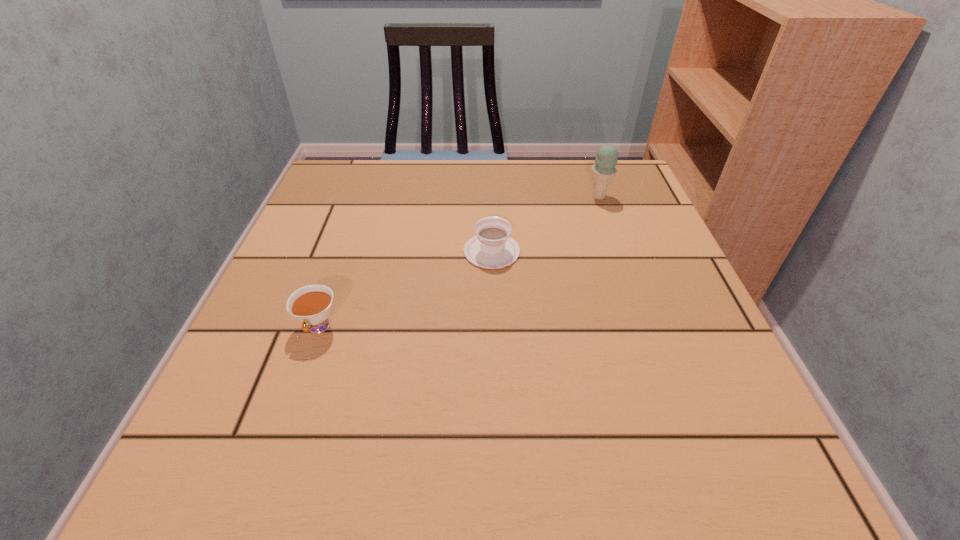
Find the location of a particular element. The width and height of the screenshot is (960, 540). empty space that is in between the second farthest object and the leftmost object is located at coordinates pyautogui.click(x=405, y=289).

Image resolution: width=960 pixels, height=540 pixels. I want to click on empty space between the tallest object and the leftmost object, so click(x=459, y=262).

Identify which object is the closest to the right teacup. Please provide its 2D coordinates. Your answer should be formatted as a tuple, i.e. [(x, y)], where the tuple contains the x and y coordinates of a point satisfying the conditions above.

[(604, 170)]

Locate an element on the screen. object that can be found as the second closest to the ice cream is located at coordinates (311, 305).

Where is `blank area in the image that satisfies the following two spatial constraints: 1. on the handle side of the second nearest object; 2. on the left side of the farthest object`? Image resolution: width=960 pixels, height=540 pixels. blank area in the image that satisfies the following two spatial constraints: 1. on the handle side of the second nearest object; 2. on the left side of the farthest object is located at coordinates (491, 197).

In order to click on vacant area that satisfies the following two spatial constraints: 1. on the handle side of the farthest object; 2. on the right side of the second object from left to right in this screenshot , I will do `click(491, 197)`.

The width and height of the screenshot is (960, 540). In order to click on free region that satisfies the following two spatial constraints: 1. on the handle side of the right teacup; 2. on the right side of the tallest object in this screenshot , I will do `click(491, 197)`.

Locate an element on the screen. The height and width of the screenshot is (540, 960). free space that satisfies the following two spatial constraints: 1. on the handle side of the rightmost object; 2. on the left side of the farther teacup is located at coordinates (491, 197).